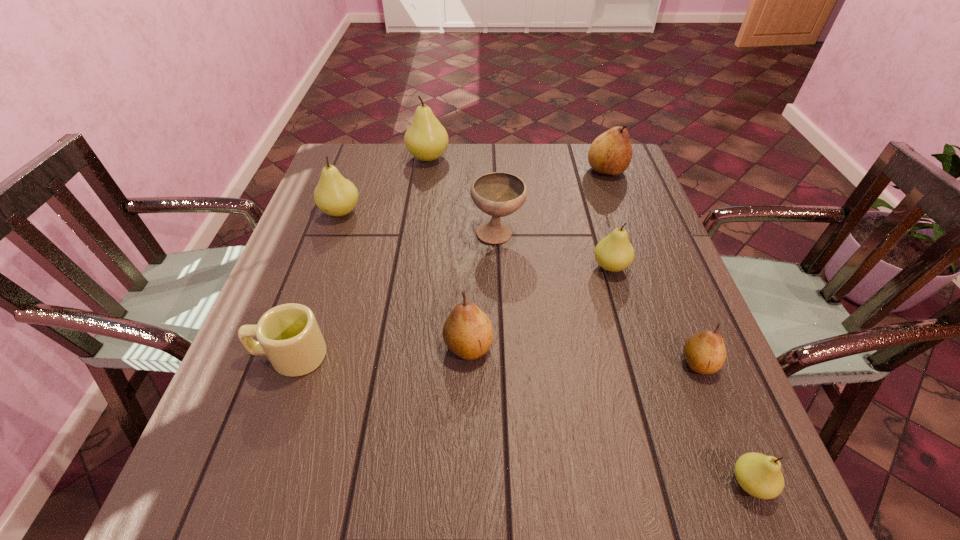
At what (x,y) coordinates should I click in order to perform the action: click on blank space at the right edge of the desktop. Please return your answer as a coordinate pair (x, y). This screenshot has height=540, width=960. Looking at the image, I should click on (645, 202).

This screenshot has height=540, width=960. I want to click on vacant area at the far left corner of the desktop, so click(x=340, y=155).

In the image, there is a desktop. Where is `vacant space at the near left corner`? Image resolution: width=960 pixels, height=540 pixels. vacant space at the near left corner is located at coordinates (228, 486).

Identify the location of vacant space at the far right corner of the desktop. (630, 170).

Where is `blank area at the near right corner`? The image size is (960, 540). blank area at the near right corner is located at coordinates (688, 494).

Identify the location of unoccupied area between the leftmost pear and the mug. (315, 284).

The image size is (960, 540). Find the location of `vacant area between the smallest green pear and the fifth pear from right to left`. vacant area between the smallest green pear and the fifth pear from right to left is located at coordinates click(x=610, y=415).

This screenshot has width=960, height=540. I want to click on unoccupied area between the seventh object from right to left and the farthest brown pear, so click(x=517, y=164).

This screenshot has height=540, width=960. I want to click on vacant point located between the tallest pear and the mug, so click(359, 256).

Identify the location of free space that is in between the chalice and the third farthest pear. (420, 223).